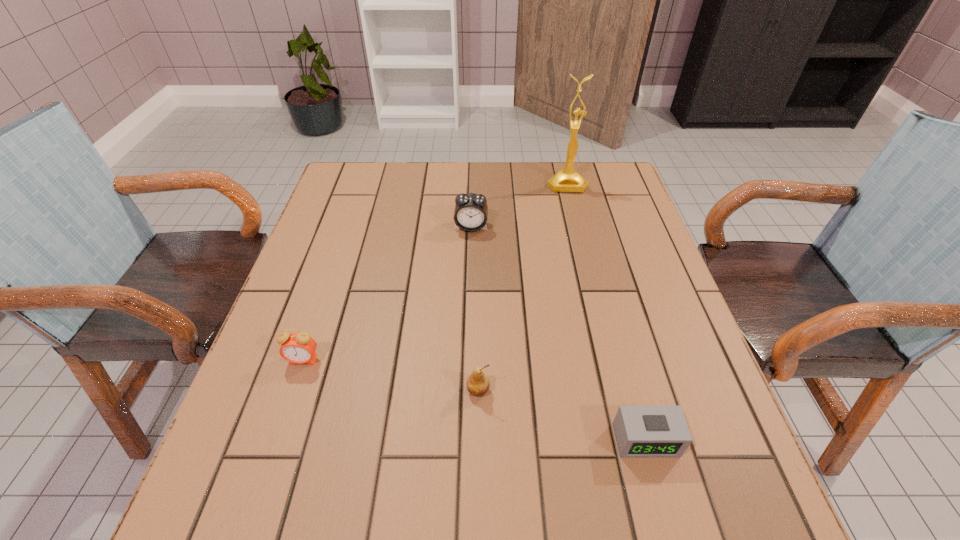
This screenshot has height=540, width=960. I want to click on blank region between the award and the second alarm clock from right to left, so click(x=518, y=205).

At what (x,y) coordinates should I click in order to perform the action: click on unoccupied area between the third farthest object and the second farthest object. Please return your answer as a coordinate pair (x, y). Looking at the image, I should click on (387, 293).

Locate an element on the screen. vacant space in between the leftmost alarm clock and the tallest object is located at coordinates (435, 272).

Identify which object is located as the third nearest to the tallest object. Please provide its 2D coordinates. Your answer should be formatted as a tuple, i.e. [(x, y)], where the tuple contains the x and y coordinates of a point satisfying the conditions above.

[(642, 431)]

What are the coordinates of `object identified as the second closest to the leftmost alarm clock` in the screenshot? It's located at (471, 211).

Select which alarm clock is the closest to the pear. Please provide its 2D coordinates. Your answer should be formatted as a tuple, i.e. [(x, y)], where the tuple contains the x and y coordinates of a point satisfying the conditions above.

[(642, 431)]

The width and height of the screenshot is (960, 540). I want to click on alarm clock that stands as the closest to the leftmost object, so click(x=471, y=211).

Locate an element on the screen. The height and width of the screenshot is (540, 960). vacant region that satisfies the following two spatial constraints: 1. on the face of the leftmost alarm clock; 2. on the right side of the second nearest object is located at coordinates (294, 390).

You are a GUI agent. You are given a task and a screenshot of the screen. Output one action in this format:
    pyautogui.click(x=<x>, y=<y>)
    Task: Click on the free location that satisfies the following two spatial constraints: 1. on the front side of the fourth farthest object; 2. on the right side of the farthest alarm clock
    The height and width of the screenshot is (540, 960).
    Given the screenshot: What is the action you would take?
    pyautogui.click(x=467, y=390)